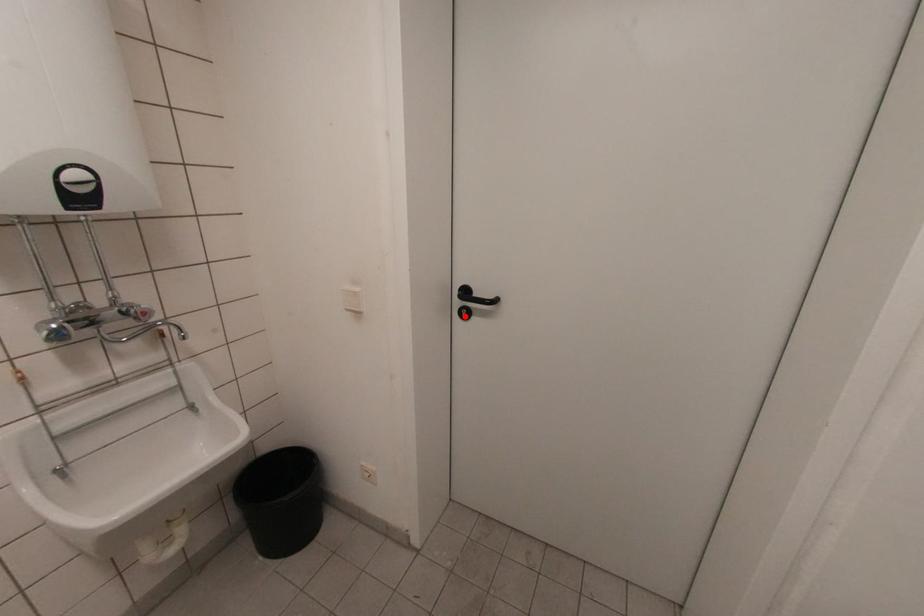
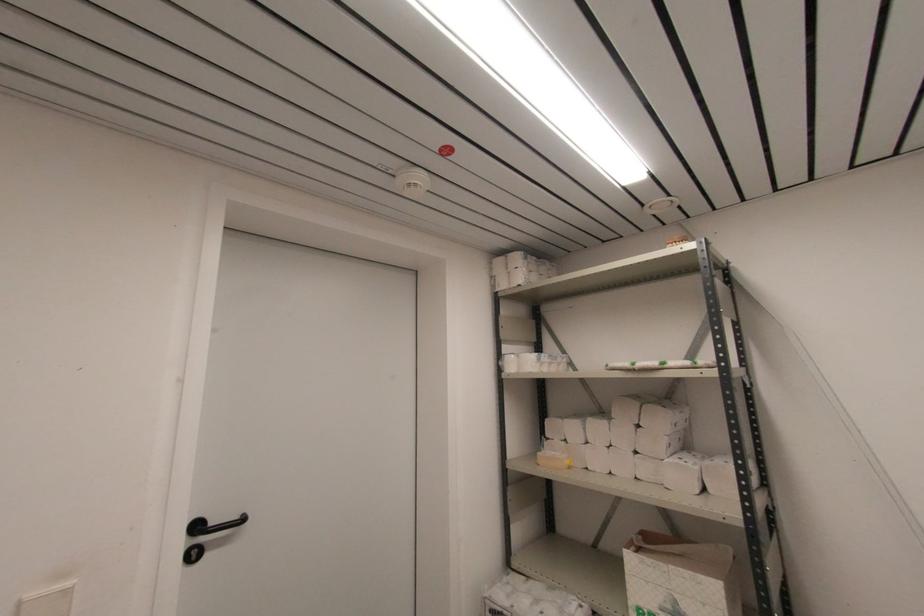
In the second image, find the point that corresponds to the highlighted location in the first image.

(196, 557)